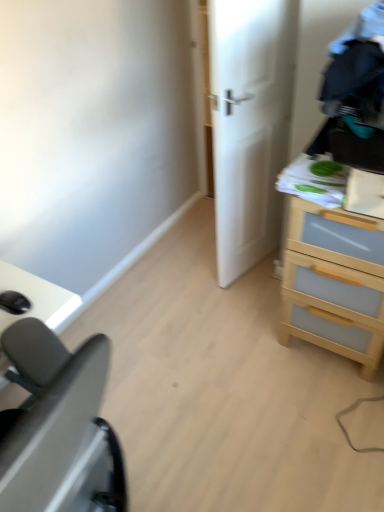
I want to click on vacant space in between light wood chest of drawers at right and black matte desk at lower left, so (x=220, y=389).